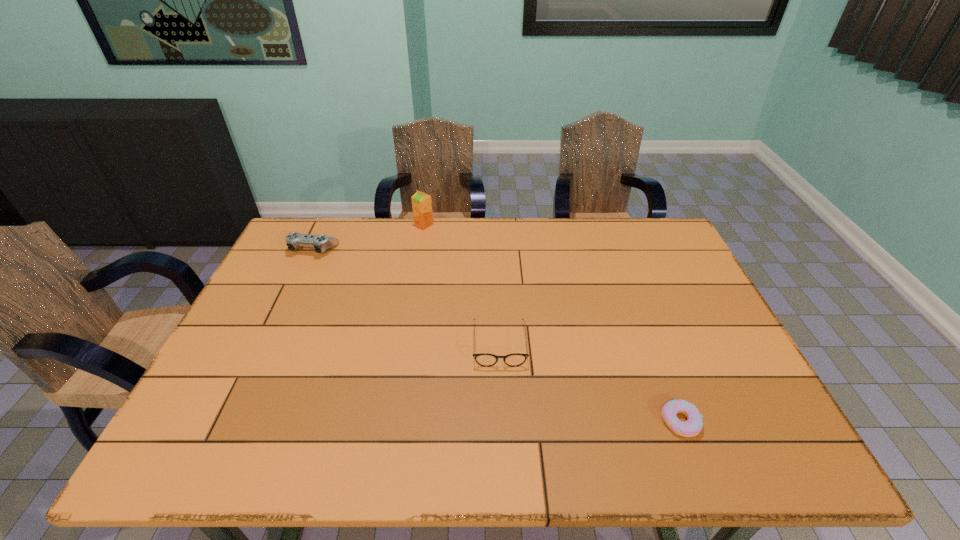
Identify the location of vacant space located 0.120m through the lenses of the spectacles. The height and width of the screenshot is (540, 960). (502, 410).

Locate an element on the screen. The image size is (960, 540). blank area located on the left of the rightmost object is located at coordinates (508, 421).

Find the location of a particular element. The width and height of the screenshot is (960, 540). orange juice located in the far edge section of the desktop is located at coordinates (421, 202).

This screenshot has width=960, height=540. In order to click on control at the far edge in this screenshot , I will do `click(321, 243)`.

You are a GUI agent. You are given a task and a screenshot of the screen. Output one action in this format:
    pyautogui.click(x=<x>, y=<y>)
    Task: Click on the object positioned at the near edge
    Image resolution: width=960 pixels, height=540 pixels.
    Given the screenshot: What is the action you would take?
    pyautogui.click(x=694, y=424)

Where is `object located at the left edge`? object located at the left edge is located at coordinates (321, 243).

Find the location of a particular element. object present at the far left corner is located at coordinates (321, 243).

In the image, there is a desktop. Identify the location of vacant space at the far edge. (545, 231).

What are the coordinates of `free space at the near edge of the desktop` in the screenshot? It's located at [283, 459].

Locate an element on the screen. Image resolution: width=960 pixels, height=540 pixels. vacant space at the left edge of the desktop is located at coordinates (280, 302).